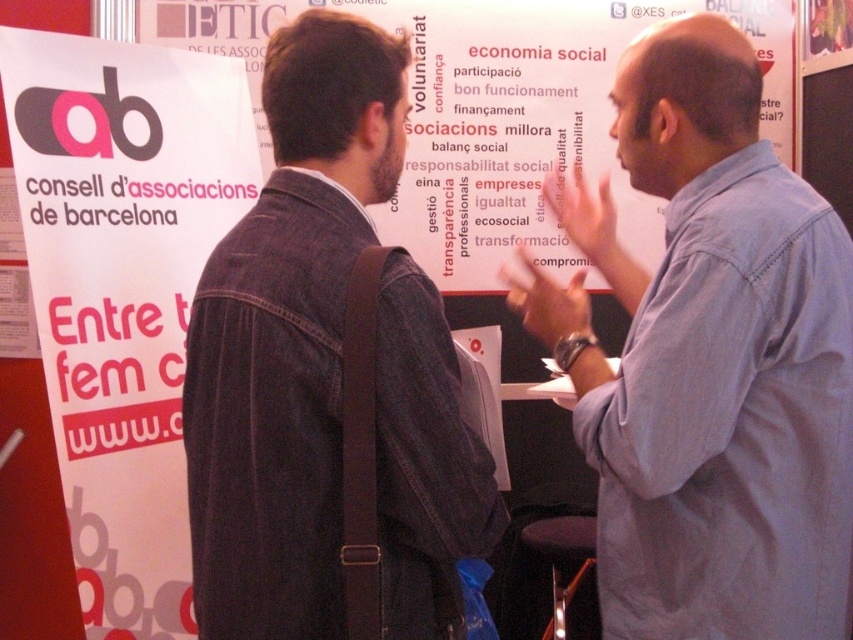
Between point (219, 381) and point (433, 13), which one is positioned behind?

Point (433, 13)

Between point (380, 349) and point (476, 184), which one is positioned behind?

Positioned behind is point (476, 184).

This screenshot has width=853, height=640. In order to click on denim jacket at center in this screenshot , I will do `click(325, 371)`.

Is blue shirt at upper right smaller than denim jacket at center?

Actually, blue shirt at upper right might be larger than denim jacket at center.

Who is more forward, (811, 579) or (325, 369)?

Point (325, 369) is more forward.

Is point (712, 532) closer to camera compared to point (390, 104)?

That is False.

The image size is (853, 640). I want to click on blue shirt at upper right, so click(x=711, y=360).

Who is higher up, blue shirt at upper right or matte paper poster at left?

matte paper poster at left is above.

Does blue shirt at upper right have a lesser width compared to matte paper poster at left?

In fact, blue shirt at upper right might be wider than matte paper poster at left.

Consider the image. Who is more distant from viewer, [691,554] or [96,400]?

The point [96,400] is behind.

Find the location of `blue shirt at upper right`. blue shirt at upper right is located at coordinates (711, 360).